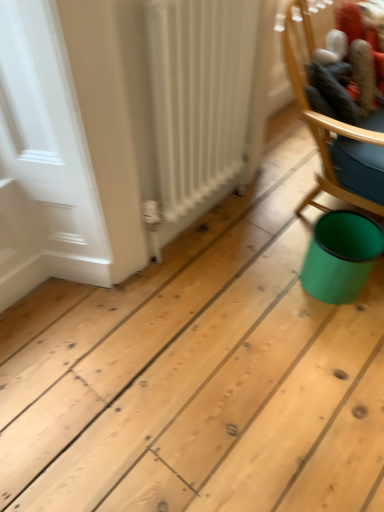
Question: Is teal plastic can at lower right behind wooden chair at upper right?

Choices:
 (A) no
 (B) yes

Answer: (B)

Question: Can wooden chair at upper right be found inside teal plastic can at lower right?

Choices:
 (A) yes
 (B) no

Answer: (B)

Question: Is the position of teal plastic can at lower right less distant than that of wooden chair at upper right?

Choices:
 (A) no
 (B) yes

Answer: (A)

Question: Are teal plastic can at lower right and wooden chair at upper right located far from each other?

Choices:
 (A) no
 (B) yes

Answer: (A)

Question: From a real-world perspective, does teal plastic can at lower right sit lower than wooden chair at upper right?

Choices:
 (A) yes
 (B) no

Answer: (A)

Question: Could you tell me if teal plastic can at lower right is turned towards wooden chair at upper right?

Choices:
 (A) no
 (B) yes

Answer: (A)

Question: Does wooden chair at upper right come behind white matte radiator at left?

Choices:
 (A) yes
 (B) no

Answer: (A)

Question: Is wooden chair at upper right positioned far away from white matte radiator at left?

Choices:
 (A) yes
 (B) no

Answer: (B)

Question: Can you see wooden chair at upper right touching white matte radiator at left?

Choices:
 (A) no
 (B) yes

Answer: (A)

Question: Considering the relative positions of wooden chair at upper right and white matte radiator at left in the image provided, is wooden chair at upper right to the left of white matte radiator at left from the viewer's perspective?

Choices:
 (A) yes
 (B) no

Answer: (B)

Question: From a real-world perspective, is wooden chair at upper right positioned under white matte radiator at left based on gravity?

Choices:
 (A) no
 (B) yes

Answer: (A)

Question: Is wooden chair at upper right positioned before white matte radiator at left?

Choices:
 (A) yes
 (B) no

Answer: (B)

Question: Is teal plastic can at lower right facing towards white matte radiator at left?

Choices:
 (A) no
 (B) yes

Answer: (A)